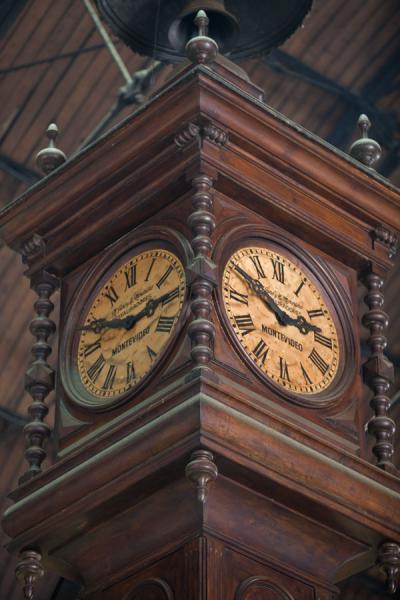
At what (x,y) coordinates should I click in order to perform the action: click on clock faces. Please return your answer as a coordinate pair (x, y). The height and width of the screenshot is (600, 400). Looking at the image, I should click on (x=282, y=347), (x=125, y=352).